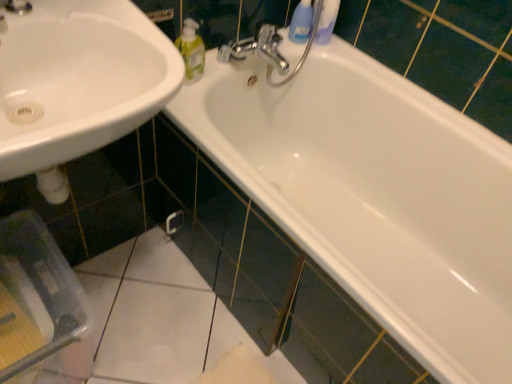
Question: From a real-world perspective, is translucent plastic bottle at upper center positioned over white glossy bathtub at upper center based on gravity?

Choices:
 (A) no
 (B) yes

Answer: (B)

Question: Can we say translucent plastic bottle at upper center lies outside white glossy bathtub at upper center?

Choices:
 (A) no
 (B) yes

Answer: (A)

Question: Does translucent plastic bottle at upper center have a larger size compared to white glossy bathtub at upper center?

Choices:
 (A) yes
 (B) no

Answer: (B)

Question: Can you confirm if translucent plastic bottle at upper center is taller than white glossy bathtub at upper center?

Choices:
 (A) yes
 (B) no

Answer: (B)

Question: Is translucent plastic bottle at upper center positioned with its back to white glossy bathtub at upper center?

Choices:
 (A) no
 (B) yes

Answer: (A)

Question: Is chrome metallic faucet at upper center spatially inside white glossy sink at lower left, or outside of it?

Choices:
 (A) inside
 (B) outside

Answer: (B)

Question: From the image's perspective, is chrome metallic faucet at upper center located above or below white glossy sink at lower left?

Choices:
 (A) above
 (B) below

Answer: (A)

Question: Is point (261, 49) closer or farther from the camera than point (12, 114)?

Choices:
 (A) closer
 (B) farther

Answer: (B)

Question: From a real-world perspective, is chrome metallic faucet at upper center physically located above or below white glossy sink at lower left?

Choices:
 (A) above
 (B) below

Answer: (B)

Question: From the image's perspective, is chrome metallic faucet at upper center positioned above or below translucent plastic bottle at upper center?

Choices:
 (A) above
 (B) below

Answer: (B)

Question: Is chrome metallic faucet at upper center in front of or behind translucent plastic bottle at upper center in the image?

Choices:
 (A) front
 (B) behind

Answer: (A)

Question: In terms of width, does chrome metallic faucet at upper center look wider or thinner when compared to translucent plastic bottle at upper center?

Choices:
 (A) wide
 (B) thin

Answer: (A)

Question: From a real-world perspective, is chrome metallic faucet at upper center above or below translucent plastic bottle at upper center?

Choices:
 (A) above
 (B) below

Answer: (B)

Question: From a real-world perspective, is white glossy sink at lower left positioned above or below chrome metallic faucet at upper center?

Choices:
 (A) below
 (B) above

Answer: (B)

Question: From the image's perspective, is white glossy sink at lower left located above or below chrome metallic faucet at upper center?

Choices:
 (A) above
 (B) below

Answer: (B)